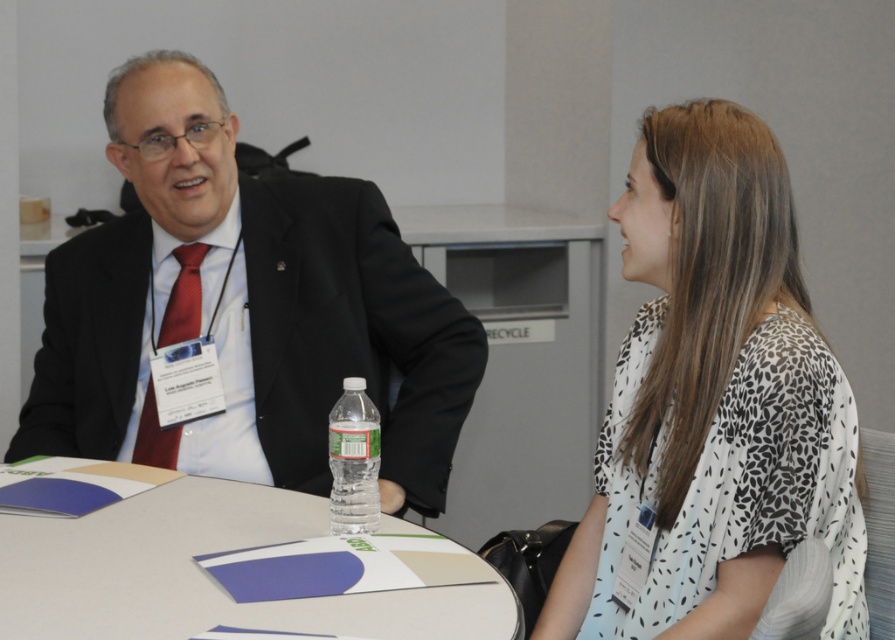
Which is behind, point (695, 596) or point (14, 536)?

The point (14, 536) is behind.

The height and width of the screenshot is (640, 895). Describe the element at coordinates (712, 404) in the screenshot. I see `white dotted blouse at center` at that location.

What do you see at coordinates (712, 404) in the screenshot? The height and width of the screenshot is (640, 895). I see `white dotted blouse at center` at bounding box center [712, 404].

Identify the location of white dotted blouse at center. The height and width of the screenshot is (640, 895). (712, 404).

Is matte black suit at center thinner than clear plastic bottle at center?

No, matte black suit at center is not thinner than clear plastic bottle at center.

Locate an element on the screen. Image resolution: width=895 pixels, height=640 pixels. matte black suit at center is located at coordinates (244, 307).

This screenshot has width=895, height=640. Identify the location of matte black suit at center. click(x=244, y=307).

Does white paper at center have a smaller size compared to clear plastic bottle at center?

No, white paper at center is not smaller than clear plastic bottle at center.

Find the location of a particular element. white paper at center is located at coordinates (228, 564).